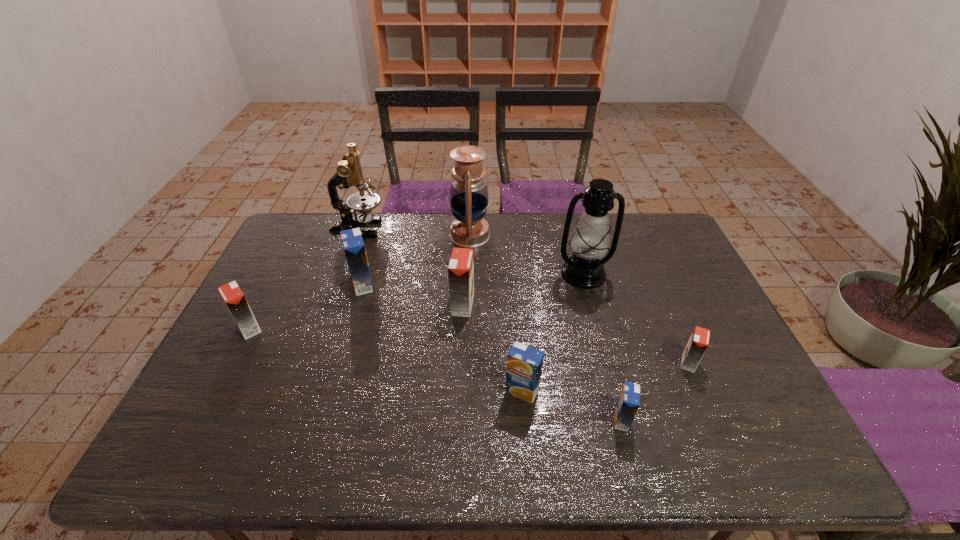
Locate an element on the screen. orange juice that is at the left edge is located at coordinates (232, 295).

Find the location of a particular element. object that is at the right edge is located at coordinates (699, 340).

I want to click on object present at the far left corner, so click(x=349, y=172).

This screenshot has height=540, width=960. What are the coordinates of `free space at the far edge` in the screenshot? It's located at (497, 245).

The height and width of the screenshot is (540, 960). I want to click on vacant region at the near edge, so click(512, 464).

Locate an element on the screen. The height and width of the screenshot is (540, 960). free space at the left edge is located at coordinates (297, 310).

In the image, there is a desktop. At what (x,y) coordinates should I click in order to perform the action: click on vacant area at the right edge. Please return your answer as a coordinate pair (x, y). This screenshot has height=540, width=960. Looking at the image, I should click on (682, 268).

This screenshot has width=960, height=540. I want to click on vacant space at the far left corner of the desktop, so click(x=303, y=233).

In the image, there is a desktop. Where is `free space at the far right corner`? The width and height of the screenshot is (960, 540). free space at the far right corner is located at coordinates (637, 214).

The height and width of the screenshot is (540, 960). I want to click on vacant point located between the left oil lamp and the biggest blue orange_juice, so click(417, 260).